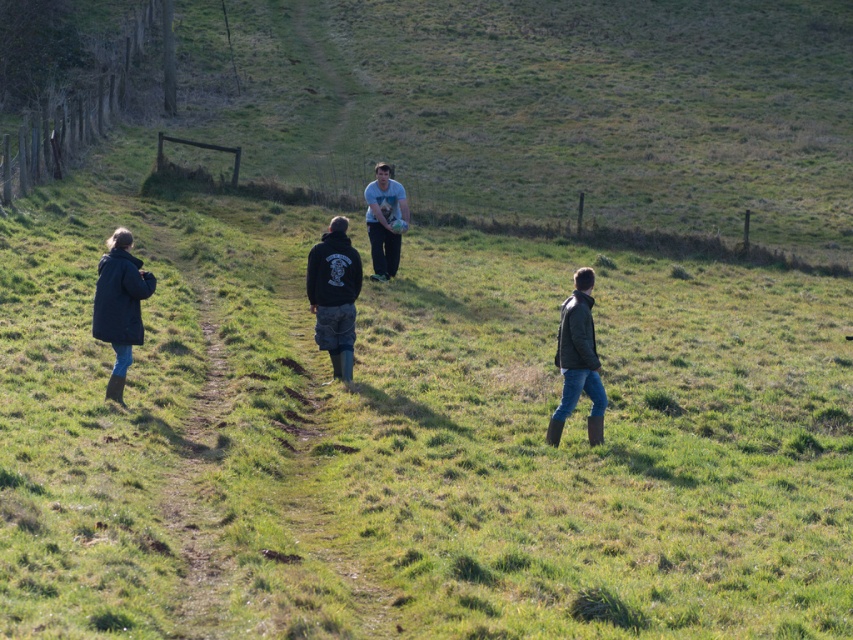
Based on the photo, you are one of the four people walking along the grassy path. You notice two specific points marked on the path ahead of you. The first point is at coordinates point (113, 376) and the second is at point (560, 355). Which point is closer to your current position if you are following the path?

Point (113, 376) is in front of point (560, 355), so it is closer to your current position along the path.

You are standing at the origin point of the image. Which direction should you move to reach the dark blue jacket at left?

You should move to the left to reach the dark blue jacket at left since it is located at point (119,305), which is to the left side of the image.